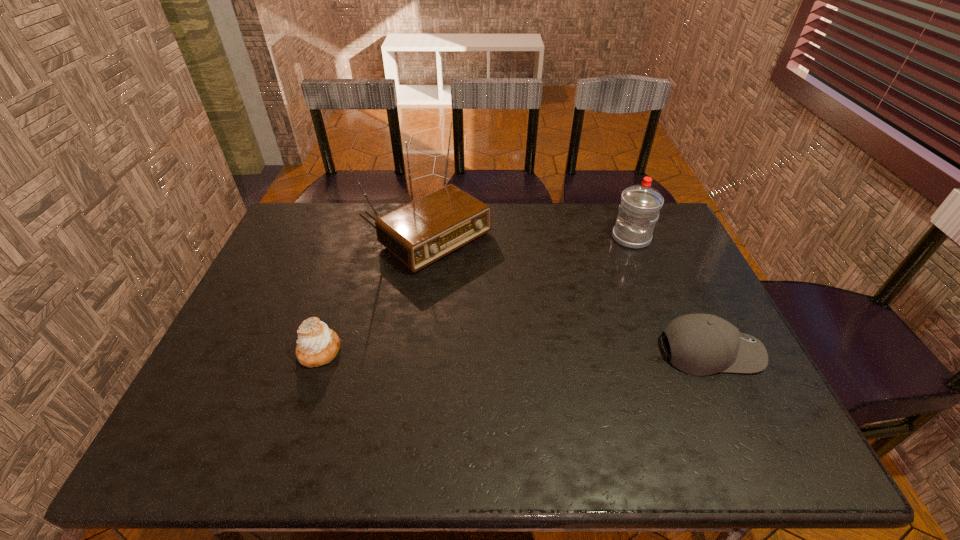
Identify the location of vacant space on the desktop that is between the shortest object and the third tallest object and is positioned on the handle side of the third shortest object. (490, 351).

The height and width of the screenshot is (540, 960). Identify the location of free spot on the desktop that is between the pastry and the second shortest object and is positioned on the front panel of the radio_receiver. (571, 352).